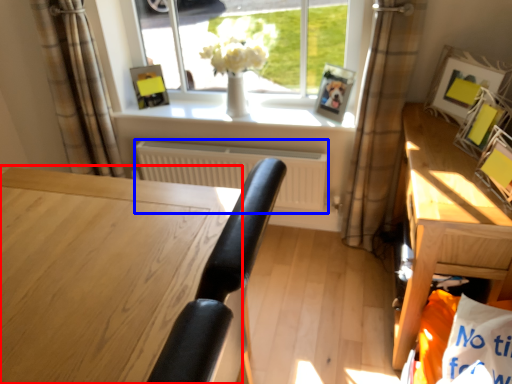
Question: Which of the following is the farthest to the observer, desk (highlighted by a red box) or radiator (highlighted by a blue box)?

Choices:
 (A) desk
 (B) radiator

Answer: (B)